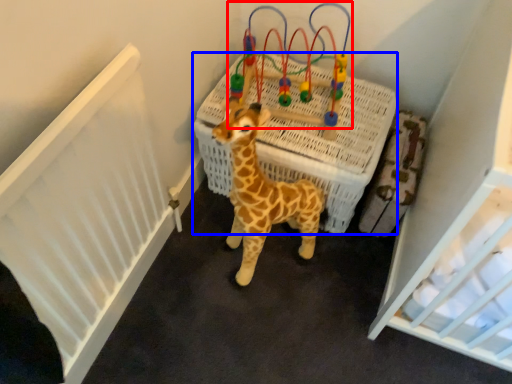
Question: Among these objects, which one is farthest to the camera, toy (highlighted by a red box) or infant bed (highlighted by a blue box)?

Choices:
 (A) toy
 (B) infant bed

Answer: (B)